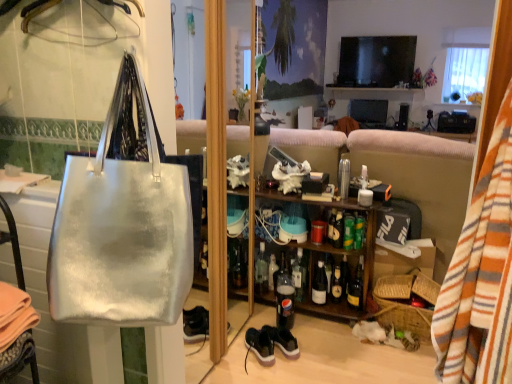
In order to face satin white tote bag at left, should I rotate leftwards or rightwards?

Turn left approximately 16.956 degrees to face it.

You are a GUI agent. You are given a task and a screenshot of the screen. Output one action in this format:
    pyautogui.click(x=<x>, y=<y>)
    Task: Click on the wooden shelf at center
    
    Given the screenshot: What is the action you would take?
    pyautogui.click(x=339, y=261)

This screenshot has height=384, width=512. What are the coordinates of `shiny gold bottle at center, which is the 8th bottle in left-to-right order` in the screenshot? It's located at (356, 287).

This screenshot has width=512, height=384. In order to click on wooden shelf at center in this screenshot , I will do [399, 173].

What do you see at coordinates (481, 275) in the screenshot?
I see `striped cotton blanket at right` at bounding box center [481, 275].

I want to click on translucent glass bottle at center, the fourth bottle when ordered from left to right, so click(x=298, y=276).

Identify the location of satin white tote bag at left. The image size is (512, 384). (124, 222).

Who is shorter, shiny black sneakers at lower center, the 1th sneakers in the right-to-left sequence, or metallic silver hanger at upper left?

metallic silver hanger at upper left.

Which is behind, point (287, 337) or point (81, 5)?

The point (287, 337) is farther.

At what (x,y) coordinates should I click in order to perform the action: click on the 2nd sneakers behind the metallic silver hanger at upper left, starting your count from the anchor. Please return your answer as a coordinate pair (x, y). The image size is (512, 384). Looking at the image, I should click on (283, 340).

Between shiny black sneakers at lower center, arranged as the second sneakers when viewed from the left, and metallic silver hanger at upper left, which one has smaller width?

Thinner between the two is metallic silver hanger at upper left.

Where is `television behind the shiny black sneakers at lower center, the 1th sneakers in the right-to-left sequence`? television behind the shiny black sneakers at lower center, the 1th sneakers in the right-to-left sequence is located at coordinates (376, 61).

From a real-world perspective, relative to matte black television at upper center, is shiny black sneakers at lower center, the 1th sneakers in the right-to-left sequence, vertically above or below?

shiny black sneakers at lower center, the 1th sneakers in the right-to-left sequence, is situated lower than matte black television at upper center in the real world.

Is shiny black sneakers at lower center, the 1th sneakers in the right-to-left sequence, further to the viewer compared to matte black television at upper center?

No, shiny black sneakers at lower center, the 1th sneakers in the right-to-left sequence, is closer to the camera.

From the image's perspective, is shiny black sneakers at lower center, arranged as the second sneakers when viewed from the left, on top of matte black television at upper center?

Incorrect, from the image's perspective, shiny black sneakers at lower center, arranged as the second sneakers when viewed from the left, is lower than matte black television at upper center.

Is point (339, 218) closer to camera compared to point (258, 356)?

No, it is behind (258, 356).

Would you say translucent glass bottle at center, acting as the sixth bottle starting from the left, is a long distance from black suede sneakers at lower center, which is counted as the 1th sneakers, starting from the left?

No, there isn't a large distance between translucent glass bottle at center, acting as the sixth bottle starting from the left, and black suede sneakers at lower center, which is counted as the 1th sneakers, starting from the left.

In terms of width, does translucent glass bottle at center, acting as the sixth bottle starting from the left, look wider or thinner when compared to black suede sneakers at lower center, which is counted as the 1th sneakers, starting from the left?

Considering their sizes, translucent glass bottle at center, acting as the sixth bottle starting from the left, looks slimmer than black suede sneakers at lower center, which is counted as the 1th sneakers, starting from the left.

Considering the relative sizes of translucent plastic soda bottle at center, which is counted as the third bottle, starting from the left, and clear glass bottle at center, which is the 8th bottle in right-to-left order, in the image provided, is translucent plastic soda bottle at center, which is counted as the third bottle, starting from the left, bigger than clear glass bottle at center, which is the 8th bottle in right-to-left order,?

Correct, translucent plastic soda bottle at center, which is counted as the third bottle, starting from the left, is larger in size than clear glass bottle at center, which is the 8th bottle in right-to-left order.

Is point (282, 267) positioned behind point (264, 273)?

Yes, it is behind point (264, 273).

From a real-world perspective, is translucent plastic soda bottle at center, which is counted as the third bottle, starting from the left, located beneath clear glass bottle at center, which is the 8th bottle in right-to-left order?

Yes, from a real-world perspective, translucent plastic soda bottle at center, which is counted as the third bottle, starting from the left, is beneath clear glass bottle at center, which is the 8th bottle in right-to-left order.

Can clear glass bottle at center, which is the 8th bottle in right-to-left order, be found inside translucent plastic soda bottle at center, the 6th bottle from the right?

No, clear glass bottle at center, which is the 8th bottle in right-to-left order, is not inside translucent plastic soda bottle at center, the 6th bottle from the right.

Is clear glass bottle at center, which is counted as the first bottle, starting from the left, next to translucent glass bottle at center, which is counted as the 5th bottle, starting from the left?

clear glass bottle at center, which is counted as the first bottle, starting from the left, is not next to translucent glass bottle at center, which is counted as the 5th bottle, starting from the left, and they're not touching.

Is point (266, 260) farther from camera compared to point (316, 283)?

Yes.

From a real-world perspective, which is physically above, clear glass bottle at center, which is the 8th bottle in right-to-left order, or translucent glass bottle at center, the 4th bottle positioned from the right?

From a 3D spatial view, clear glass bottle at center, which is the 8th bottle in right-to-left order, is above.

From the image's perspective, does clear glass bottle at center, which is counted as the first bottle, starting from the left, appear lower than translucent glass bottle at center, which is counted as the 5th bottle, starting from the left?

Incorrect, from the image's perspective, clear glass bottle at center, which is counted as the first bottle, starting from the left, is higher than translucent glass bottle at center, which is counted as the 5th bottle, starting from the left.

From a real-world perspective, is shiny gold bottle at center, which is counted as the first bottle, starting from the right, above or below metallic silver hanger at upper left?

From a real-world perspective, shiny gold bottle at center, which is counted as the first bottle, starting from the right, is physically below metallic silver hanger at upper left.

Which of these two, shiny gold bottle at center, which is counted as the first bottle, starting from the right, or metallic silver hanger at upper left, is smaller?

shiny gold bottle at center, which is counted as the first bottle, starting from the right.

Is shiny gold bottle at center, which is the 8th bottle in left-to-right order, aimed at metallic silver hanger at upper left?

No, shiny gold bottle at center, which is the 8th bottle in left-to-right order, is not turned towards metallic silver hanger at upper left.

How much distance is there between shiny gold bottle at center, which is counted as the first bottle, starting from the right, and metallic silver hanger at upper left?

shiny gold bottle at center, which is counted as the first bottle, starting from the right, is 6.14 feet away from metallic silver hanger at upper left.

Which is more to the left, translucent glass bottle at center, the fourth bottle when ordered from left to right, or translucent glass bottle at center, arranged as the second bottle when viewed from the left?

Positioned to the left is translucent glass bottle at center, arranged as the second bottle when viewed from the left.

Considering the sizes of objects translucent glass bottle at center, the fourth bottle when ordered from left to right, and translucent glass bottle at center, arranged as the second bottle when viewed from the left, in the image provided, who is taller, translucent glass bottle at center, the fourth bottle when ordered from left to right, or translucent glass bottle at center, arranged as the second bottle when viewed from the left,?

translucent glass bottle at center, the fourth bottle when ordered from left to right, is taller.

Can you confirm if translucent glass bottle at center, the fifth bottle positioned from the right, is wider than translucent glass bottle at center, positioned as the seventh bottle in right-to-left order?

Yes.

Which object is closer to the camera taking this photo, translucent glass bottle at center, the fifth bottle positioned from the right, or translucent glass bottle at center, positioned as the seventh bottle in right-to-left order?

translucent glass bottle at center, the fifth bottle positioned from the right, is closer to the camera.

The height and width of the screenshot is (384, 512). There is a shiny black sneakers at lower center, arranged as the second sneakers when viewed from the left. Find the location of `hanger above it (from a real-world perspective)`. hanger above it (from a real-world perspective) is located at coordinates (37, 13).

Where is `sneakers that is the 1st object located in front of the matte black television at upper center`? sneakers that is the 1st object located in front of the matte black television at upper center is located at coordinates (283, 340).

Considering their positions, is matte black television at upper center positioned closer to striped cotton blanket at right than satin white tote bag at left?

The object closer to striped cotton blanket at right is satin white tote bag at left.

Estimate the real-world distances between objects in this image. Which object is further from shiny black sneakers at lower center, arranged as the second sneakers when viewed from the left, translucent glass bottle at center, the fourth bottle when ordered from left to right, or translucent plastic soda bottle at center, the 6th bottle from the right?

translucent glass bottle at center, the fourth bottle when ordered from left to right, lies further to shiny black sneakers at lower center, arranged as the second sneakers when viewed from the left, than the other object.

In the scene shown: Estimate the real-world distances between objects in this image. Which object is further from translucent glass bottle at center, the third bottle positioned from the right, shiny black sneakers at lower center, the 1th sneakers in the right-to-left sequence, or shiny gold bottle at center, which is counted as the first bottle, starting from the right?

Based on the image, shiny black sneakers at lower center, the 1th sneakers in the right-to-left sequence, appears to be further to translucent glass bottle at center, the third bottle positioned from the right.

Looking at this image, from the image, which object appears to be nearer to black suede sneakers at lower center, which is counted as the second sneakers, starting from the right, translucent glass bottle at center, the fifth bottle positioned from the right, or translucent glass bottle at center, the third bottle positioned from the right?

The object closer to black suede sneakers at lower center, which is counted as the second sneakers, starting from the right, is translucent glass bottle at center, the fifth bottle positioned from the right.

When comparing their distances from shiny metallic bottle at center, which is counted as the seventh bottle, starting from the left, does translucent plastic soda bottle at center, which is counted as the third bottle, starting from the left, or metallic silver cup at center seem further?

The object further to shiny metallic bottle at center, which is counted as the seventh bottle, starting from the left, is translucent plastic soda bottle at center, which is counted as the third bottle, starting from the left.

When comparing their distances from shiny metallic bottle at center, which is counted as the seventh bottle, starting from the left, does shiny gold bottle at center, which is the 8th bottle in left-to-right order, or translucent glass bottle at center, the fourth bottle when ordered from left to right, seem closer?

shiny gold bottle at center, which is the 8th bottle in left-to-right order.

Based on their spatial positions, is wooden shelf at center or translucent glass bottle at center, the fifth bottle positioned from the right, closer to shiny gold bottle at center, which is counted as the first bottle, starting from the right?

translucent glass bottle at center, the fifth bottle positioned from the right, is positioned closer to the anchor shiny gold bottle at center, which is counted as the first bottle, starting from the right.

When comparing their distances from matte cardboard box at lower right, does translucent glass bottle at center, the 4th bottle positioned from the right, or brown woven picnic basket at lower right seem further?

translucent glass bottle at center, the 4th bottle positioned from the right, is further to matte cardboard box at lower right.

This screenshot has width=512, height=384. What are the coordinates of `shelf that lies between translucent glass bottle at center, acting as the sixth bottle starting from the left, and shiny gold bottle at center, which is counted as the first bottle, starting from the right, from top to bottom` in the screenshot? It's located at (339, 261).

Where is `coffee cup located between satin white tote bag at left and translucent glass bottle at center, the fourth bottle when ordered from left to right, in the depth direction`? coffee cup located between satin white tote bag at left and translucent glass bottle at center, the fourth bottle when ordered from left to right, in the depth direction is located at coordinates (318, 231).

Where is `coffee cup located between metallic silver hanger at upper left and matte black television at upper center in the depth direction`? This screenshot has height=384, width=512. coffee cup located between metallic silver hanger at upper left and matte black television at upper center in the depth direction is located at coordinates (318, 231).

Locate an element on the screen. studio couch between striped cotton blanket at right and matte cardboard box at lower right in the front-back direction is located at coordinates (399, 173).